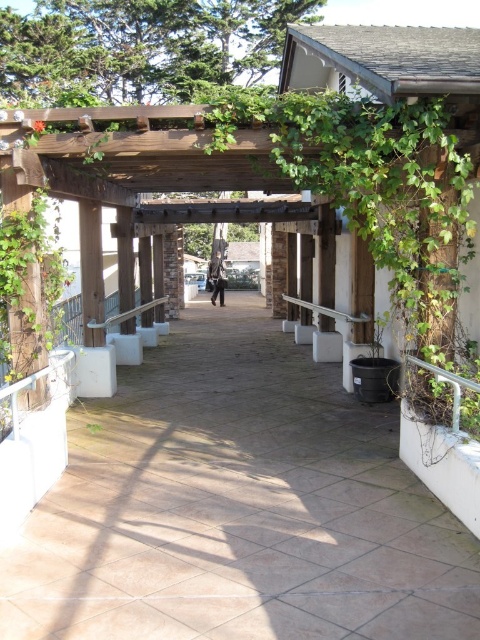
Who is taller, brown tile path at center or silver metallic handrail at center?

Standing taller between the two is brown tile path at center.

Is brown tile path at center above silver metallic handrail at center?

Incorrect, brown tile path at center is not positioned above silver metallic handrail at center.

You are a GUI agent. You are given a task and a screenshot of the screen. Output one action in this format:
    pyautogui.click(x=<x>, y=<y>)
    Task: Click on the brown tile path at center
    This screenshot has height=640, width=480.
    Given the screenshot: What is the action you would take?
    pyautogui.click(x=237, y=506)